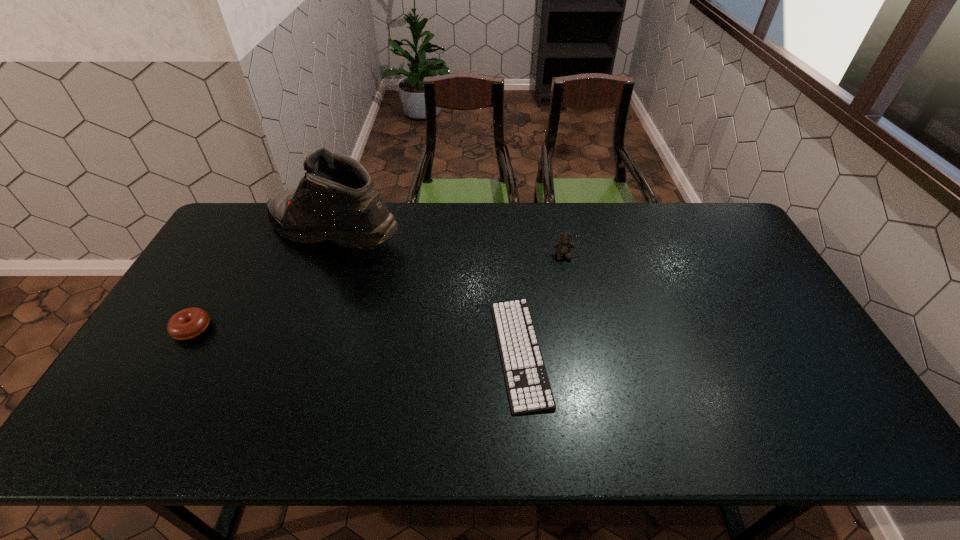
The image size is (960, 540). In the image, there is a desktop. Find the location of `vacant space at the right edge`. vacant space at the right edge is located at coordinates (785, 362).

Locate an element on the screen. vacant space at the far left corner is located at coordinates (234, 245).

In the image, there is a desktop. Identify the location of free region at the near left corner. (110, 448).

Find the location of a particular element. vacant space at the far right corner of the desktop is located at coordinates (695, 225).

The image size is (960, 540). Identify the location of free space between the doughnut and the second tallest object. (377, 292).

The width and height of the screenshot is (960, 540). Identify the location of free space between the second shortest object and the computer keyboard. (356, 340).

I want to click on free space between the shortest object and the teddy bear, so click(x=541, y=304).

Find the location of `vacant area that lies between the rightmost object and the ski boot`. vacant area that lies between the rightmost object and the ski boot is located at coordinates (448, 244).

Locate an element on the screen. The width and height of the screenshot is (960, 540). free space between the shortest object and the teddy bear is located at coordinates (541, 304).

Locate an element on the screen. free space between the doughnut and the third object from left to right is located at coordinates (356, 340).